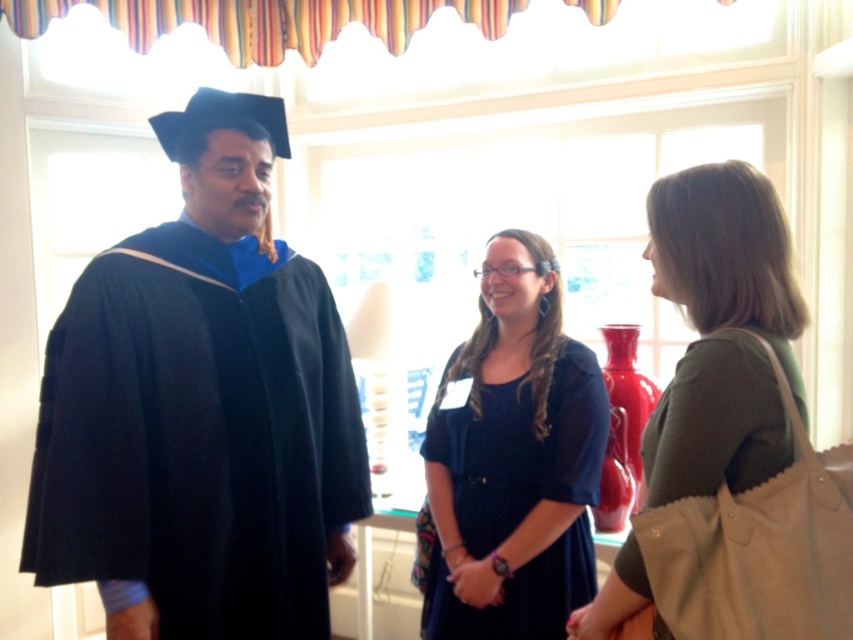
You are a photographer at this event and need to ensure both the matte black graduation gown at left and the matte black dress at center are visible in the photo. Which one should you focus on first to make sure they are both in frame?

You should focus on the matte black graduation gown at left first because it is taller than the matte black dress at center, so ensuring it fits in the frame will also accommodate the shorter dress.